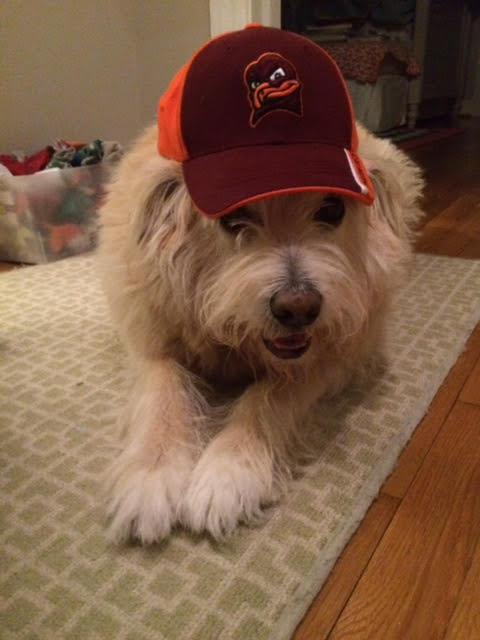
Identify the location of hardwood floor. The width and height of the screenshot is (480, 640). (394, 572).